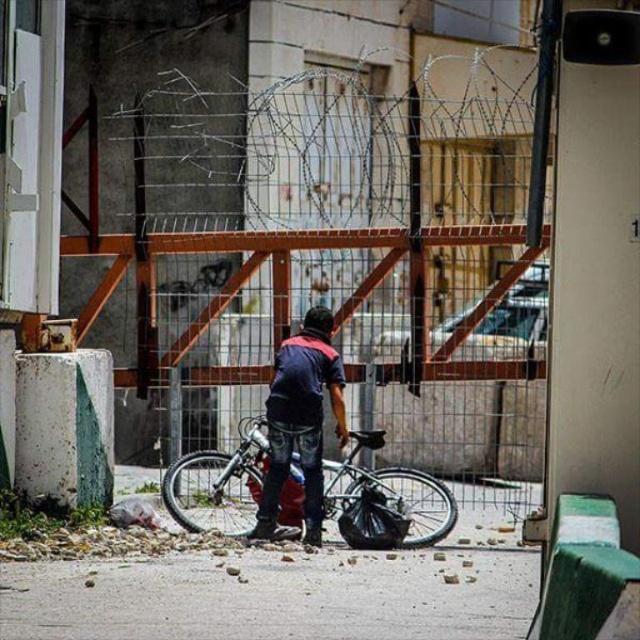
Question: Among these objects, which one is farthest from the camera?

Choices:
 (A) dark blue denim jeans at center
 (B) metallic silver bicycle at center

Answer: (B)

Question: Is metallic silver bicycle at center positioned at the back of dark blue denim jeans at center?

Choices:
 (A) no
 (B) yes

Answer: (B)

Question: Which of the following is the closest to the observer?

Choices:
 (A) metallic silver bicycle at center
 (B) dark blue denim jeans at center

Answer: (B)

Question: Does metallic silver bicycle at center lie in front of dark blue denim jeans at center?

Choices:
 (A) yes
 (B) no

Answer: (B)

Question: Can you confirm if metallic silver bicycle at center is bigger than dark blue denim jeans at center?

Choices:
 (A) yes
 (B) no

Answer: (A)